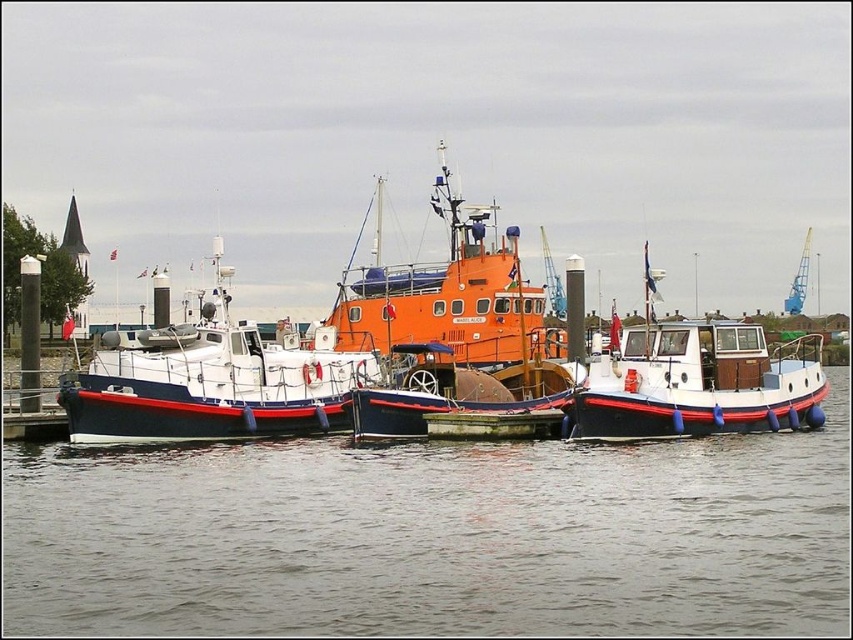
You are standing on the dock and want to know how far the point marked at coordinates (x=421, y=401) is from you. Can you determine the distance?

The point marked at coordinates (x=421, y=401) is 85.08 meters away from the viewer.

You are standing on the dock and see the point marked at coordinates (x=433, y=536) in the scene. What is the surface condition of the area around that point?

The point at (x=433, y=536) is on smooth water at center, so the surface around that point is smooth.

In the scene shown: You are a dock worker who needs to secure both the orange matte tugboat at center and the white matte boat at left. Based on their positions, which boat should you secure first if you want to start from the lower position?

You should secure the white matte boat at left first because the orange matte tugboat at center is located above it, meaning the white matte boat at left is lower down.